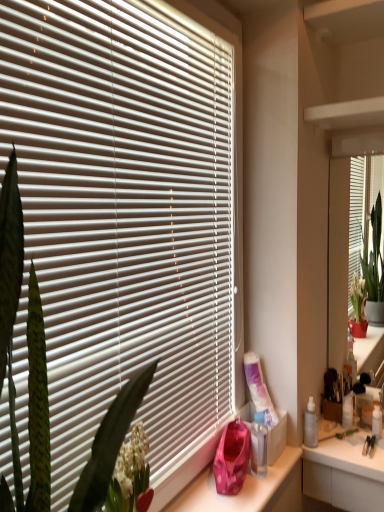
Locate an element on the screen. vacant area that lies between translucent plastic spray bottle at right, which is counted as the first toiletry, starting from the left, and white plastic bottle at right, the second toiletry in the front-to-back sequence is located at coordinates (329, 437).